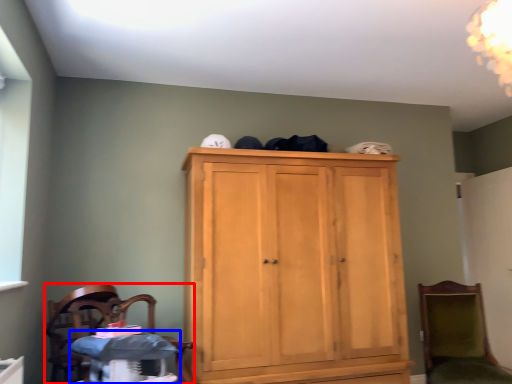
Question: Among these objects, which one is nearest to the camera, chair (highlighted by a red box) or changing table (highlighted by a blue box)?

Choices:
 (A) chair
 (B) changing table

Answer: (A)